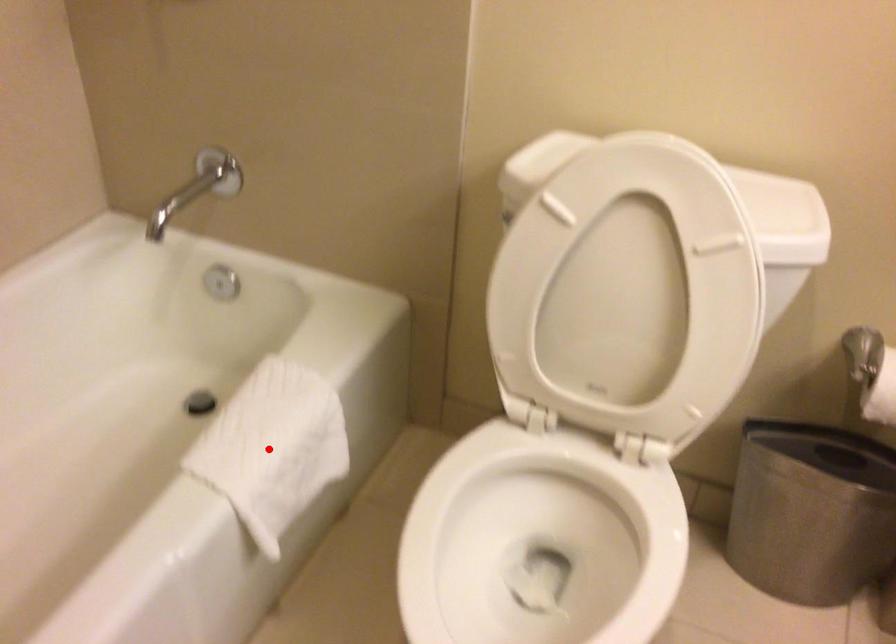
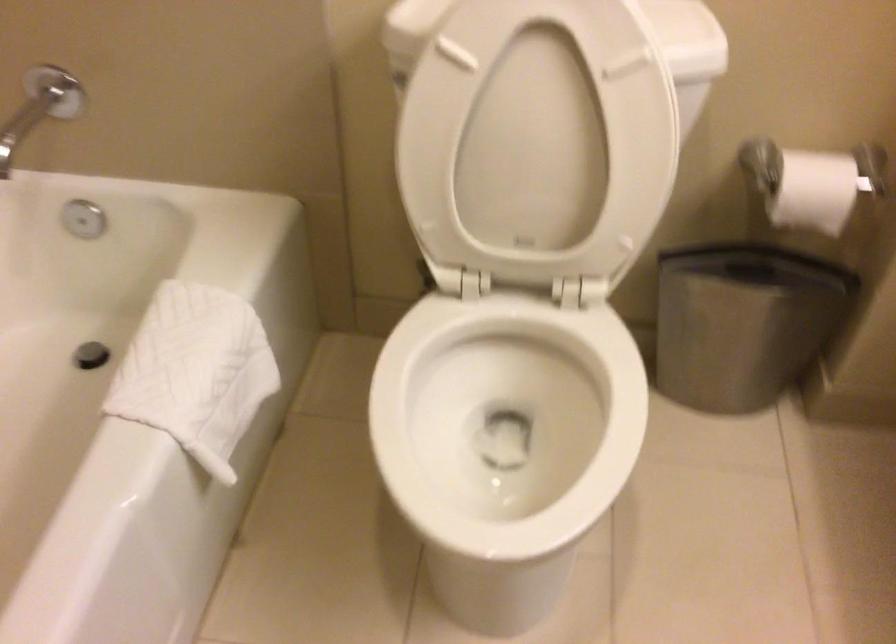
In the second image, find the point that corresponds to the highlighted location in the first image.

(195, 372)